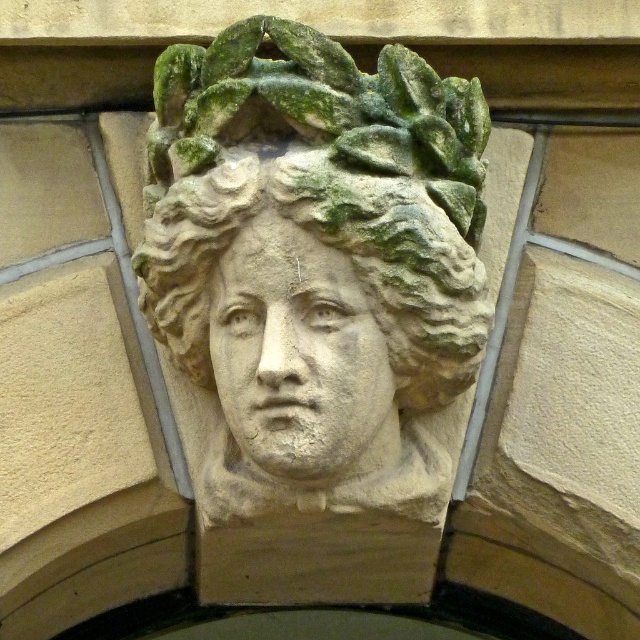
Can you confirm if stone sculpture at center is positioned above stone face at center?

Correct, stone sculpture at center is located above stone face at center.

Who is more forward, (378, 141) or (284, 266)?

Positioned in front is point (284, 266).

The height and width of the screenshot is (640, 640). I want to click on stone sculpture at center, so click(316, 262).